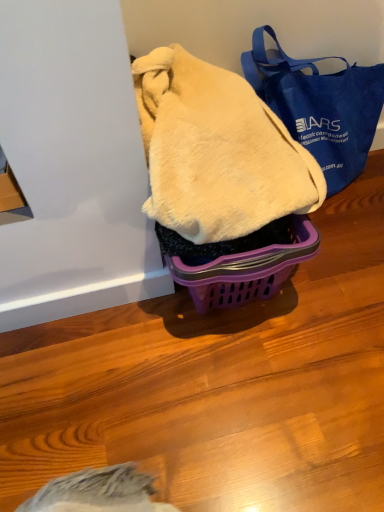
Where is `free space in front of blue canvas tote bag at upper right`? Image resolution: width=384 pixels, height=512 pixels. free space in front of blue canvas tote bag at upper right is located at coordinates (342, 278).